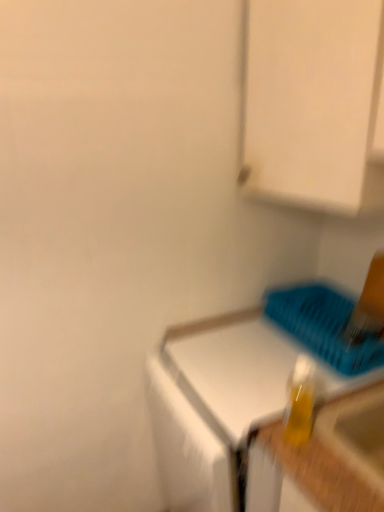
Locate an element on the screen. This screenshot has width=384, height=512. translucent yellow bottle at lower right is located at coordinates (299, 402).

Looking at this image, what is the approximate height of white matte cabinet at upper right?

It is 21.76 inches.

Describe the element at coordinates (315, 103) in the screenshot. I see `white matte cabinet at upper right` at that location.

The image size is (384, 512). In order to click on translucent yellow bottle at lower right in this screenshot , I will do `click(299, 402)`.

Is white matte cabinet at upper right far from translucent yellow bottle at lower right?

No, white matte cabinet at upper right is in close proximity to translucent yellow bottle at lower right.

Considering the relative sizes of white matte cabinet at upper right and translucent yellow bottle at lower right in the image provided, is white matte cabinet at upper right taller than translucent yellow bottle at lower right?

Indeed, white matte cabinet at upper right has a greater height compared to translucent yellow bottle at lower right.

From a real-world perspective, which object rests below the other?

In real-world perspective, translucent yellow bottle at lower right is lower.

Between point (328, 153) and point (309, 368), which one is positioned behind?

Positioned behind is point (309, 368).

Is blue plastic basket at lower right wider than white matte cabinet at upper right?

Incorrect, the width of blue plastic basket at lower right does not surpass that of white matte cabinet at upper right.

What's the angular difference between blue plastic basket at lower right and white matte cabinet at upper right's facing directions?

They differ by 2.25 degrees in their facing directions.

Which object is positioned more to the right, blue plastic basket at lower right or white matte cabinet at upper right?

blue plastic basket at lower right is more to the right.

From the image's perspective, would you say blue plastic basket at lower right is shown under white matte cabinet at upper right?

Indeed, from the image's perspective, blue plastic basket at lower right is shown beneath white matte cabinet at upper right.

Between white glossy countertop at center and white matte cabinet at upper right, which one is positioned behind?

white glossy countertop at center is more distant.

Is white glossy countertop at center far from white matte cabinet at upper right?

No, there isn't a large distance between white glossy countertop at center and white matte cabinet at upper right.

Which is nearer, (255,414) or (254,17)?

Point (255,414).

Does white matte cabinet at upper right turn towards white glossy countertop at center?

No, white matte cabinet at upper right is not turned towards white glossy countertop at center.

Does white matte cabinet at upper right have a larger size compared to white glossy countertop at center?

No.

Consider the image. Is white matte cabinet at upper right closer to the viewer compared to white glossy countertop at center?

Yes, it is.

Measure the distance from white matte cabinet at upper right to white glossy countertop at center.

The distance of white matte cabinet at upper right from white glossy countertop at center is 24.73 inches.

Based on the photo, is translucent yellow bottle at lower right to the left of blue plastic basket at lower right from the viewer's perspective?

Indeed, translucent yellow bottle at lower right is positioned on the left side of blue plastic basket at lower right.

Is translucent yellow bottle at lower right positioned with its back to blue plastic basket at lower right?

No, translucent yellow bottle at lower right is not facing the opposite direction of blue plastic basket at lower right.

The image size is (384, 512). I want to click on basket below the translucent yellow bottle at lower right (from a real-world perspective), so (x=323, y=325).

This screenshot has width=384, height=512. I want to click on countertop that appears below the translucent yellow bottle at lower right (from the image's perspective), so click(215, 403).

Considering the positions of objects translucent yellow bottle at lower right and white glossy countertop at center in the image provided, who is more to the left, translucent yellow bottle at lower right or white glossy countertop at center?

Positioned to the left is translucent yellow bottle at lower right.

In terms of height, does translucent yellow bottle at lower right look taller or shorter compared to white glossy countertop at center?

In the image, translucent yellow bottle at lower right appears to be shorter than white glossy countertop at center.

Is translucent yellow bottle at lower right located outside white glossy countertop at center?

Indeed, translucent yellow bottle at lower right is completely outside white glossy countertop at center.

Is blue plastic basket at lower right inside white glossy countertop at center?

No, blue plastic basket at lower right is located outside of white glossy countertop at center.

From a real-world perspective, relative to blue plastic basket at lower right, is white glossy countertop at center vertically above or below?

From a real-world perspective, white glossy countertop at center is physically below blue plastic basket at lower right.

Between white glossy countertop at center and blue plastic basket at lower right, which one is positioned in front?

white glossy countertop at center is in front.

Which object is wider, white glossy countertop at center or blue plastic basket at lower right?

Wider between the two is white glossy countertop at center.

Locate an element on the screen. bottle located behind the white matte cabinet at upper right is located at coordinates (299, 402).

This screenshot has width=384, height=512. I want to click on basket below the white matte cabinet at upper right (from a real-world perspective), so click(x=323, y=325).

Considering their positions, is white glossy countertop at center positioned closer to blue plastic basket at lower right than translucent yellow bottle at lower right?

translucent yellow bottle at lower right lies closer to blue plastic basket at lower right than the other object.

Considering their positions, is white matte cabinet at upper right positioned further to translucent yellow bottle at lower right than blue plastic basket at lower right?

white matte cabinet at upper right.

From the image, which object appears to be nearer to white glossy countertop at center, blue plastic basket at lower right or white matte cabinet at upper right?

blue plastic basket at lower right.

Considering their positions, is white glossy countertop at center positioned further to blue plastic basket at lower right than white matte cabinet at upper right?

white matte cabinet at upper right is positioned further to the anchor blue plastic basket at lower right.

Based on their spatial positions, is translucent yellow bottle at lower right or white matte cabinet at upper right closer to blue plastic basket at lower right?

translucent yellow bottle at lower right is positioned closer to the anchor blue plastic basket at lower right.

Looking at the image, which one is located further to translucent yellow bottle at lower right, white glossy countertop at center or white matte cabinet at upper right?

white matte cabinet at upper right is positioned further to the anchor translucent yellow bottle at lower right.

Which object lies further to the anchor point white matte cabinet at upper right, blue plastic basket at lower right or white glossy countertop at center?

Based on the image, white glossy countertop at center appears to be further to white matte cabinet at upper right.

Based on their spatial positions, is white matte cabinet at upper right or blue plastic basket at lower right further from white glossy countertop at center?

white matte cabinet at upper right.

Identify the location of basket between white matte cabinet at upper right and translucent yellow bottle at lower right in the up-down direction. (323, 325).

The image size is (384, 512). Identify the location of bottle between white matte cabinet at upper right and white glossy countertop at center vertically. (299, 402).

At what (x,y) coordinates should I click in order to perform the action: click on bottle between blue plastic basket at lower right and white glossy countertop at center in the vertical direction. Please return your answer as a coordinate pair (x, y). This screenshot has width=384, height=512. Looking at the image, I should click on (299, 402).

This screenshot has width=384, height=512. I want to click on basket that lies between white matte cabinet at upper right and white glossy countertop at center from top to bottom, so click(323, 325).